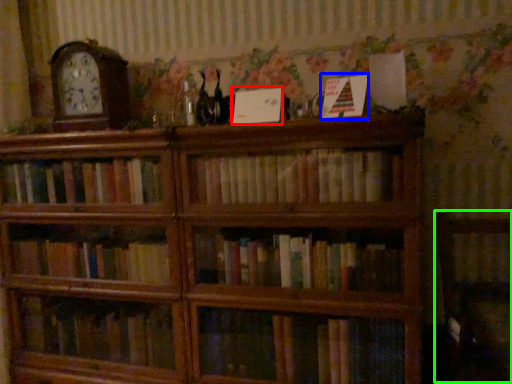
Question: Considering the real-world distances, which object is farthest from paperback book (highlighted by a red box)? paperback book (highlighted by a blue box) or armchair (highlighted by a green box)?

Choices:
 (A) paperback book
 (B) armchair

Answer: (B)